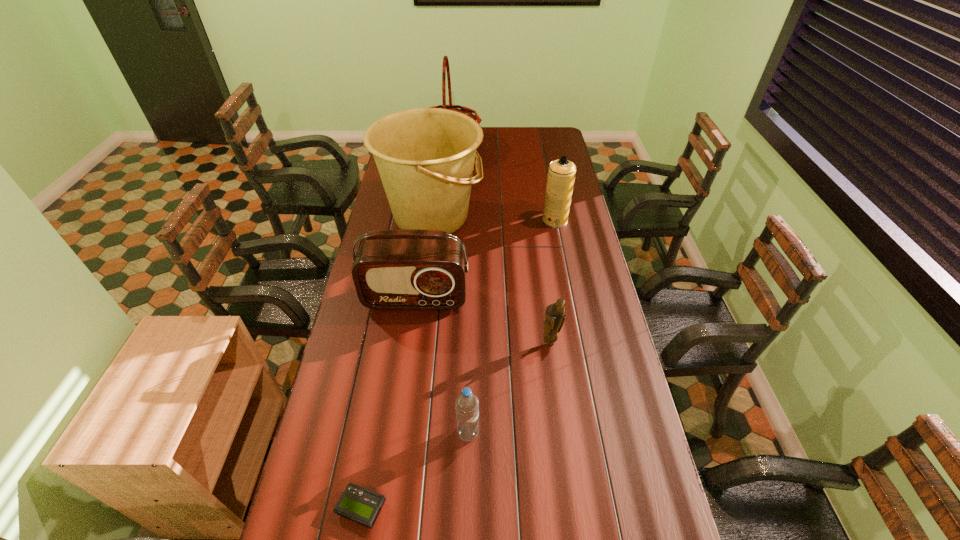
Locate an element on the screen. The width and height of the screenshot is (960, 540). free spot between the rightmost object and the radio receiver is located at coordinates (485, 259).

Locate an element on the screen. This screenshot has width=960, height=540. vacant area that lies between the second nearest object and the second tallest object is located at coordinates (450, 325).

The image size is (960, 540). Identify the location of free space between the bucket and the fifth farthest object. (491, 280).

Identify the location of unoccupied area between the nearest object and the rightmost object. Image resolution: width=960 pixels, height=540 pixels. (458, 364).

Image resolution: width=960 pixels, height=540 pixels. I want to click on vacant space in between the shortest object and the water bottle, so click(415, 471).

At what (x,y) coordinates should I click in order to perform the action: click on object that is the fifth closest to the rightmost object. Please return your answer as a coordinate pair (x, y). Image resolution: width=960 pixels, height=540 pixels. Looking at the image, I should click on (466, 404).

Where is `object that stands as the second closest to the shortest object`? object that stands as the second closest to the shortest object is located at coordinates (406, 269).

Where is `free region that satisfies the following two spatial constraints: 1. on the front panel of the fourth nearest object; 2. on the right side of the second nearest object`? Image resolution: width=960 pixels, height=540 pixels. free region that satisfies the following two spatial constraints: 1. on the front panel of the fourth nearest object; 2. on the right side of the second nearest object is located at coordinates [396, 434].